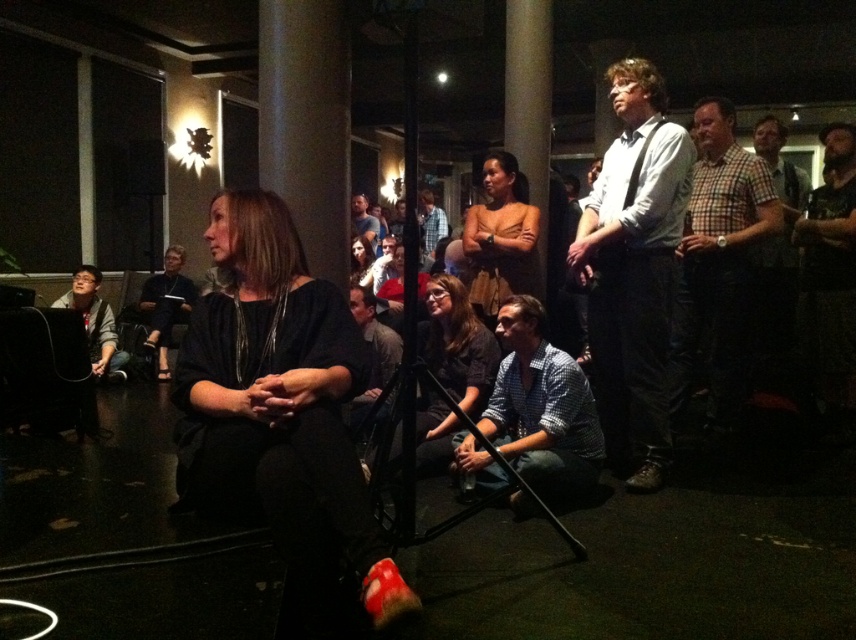
Does gray fabric jacket at left have a smaller size compared to blue plaid shirt at center?

Indeed, gray fabric jacket at left has a smaller size compared to blue plaid shirt at center.

Between point (111, 316) and point (432, 253), which one is positioned in front?

Point (111, 316) is in front.

This screenshot has height=640, width=856. Find the location of `gray fabric jacket at left`. gray fabric jacket at left is located at coordinates (94, 321).

Does brown leather purse at center have a greater width compared to gray fabric shirt at center?

Yes, brown leather purse at center is wider than gray fabric shirt at center.

Does point (510, 273) lie in front of point (384, 358)?

That is False.

In the scene shown: Who is more forward, (x=495, y=168) or (x=354, y=296)?

Point (x=495, y=168) is in front.

This screenshot has height=640, width=856. I want to click on brown leather purse at center, so point(500,237).

Does dark gray sweater at center have a greater height compared to blue plaid shirt at center?

No, dark gray sweater at center is not taller than blue plaid shirt at center.

Who is shorter, dark gray sweater at center or blue plaid shirt at center?

With less height is dark gray sweater at center.

Who is more forward, (x=456, y=424) or (x=421, y=212)?

Point (x=456, y=424)

The height and width of the screenshot is (640, 856). In order to click on dark gray sweater at center in this screenshot , I will do `click(456, 344)`.